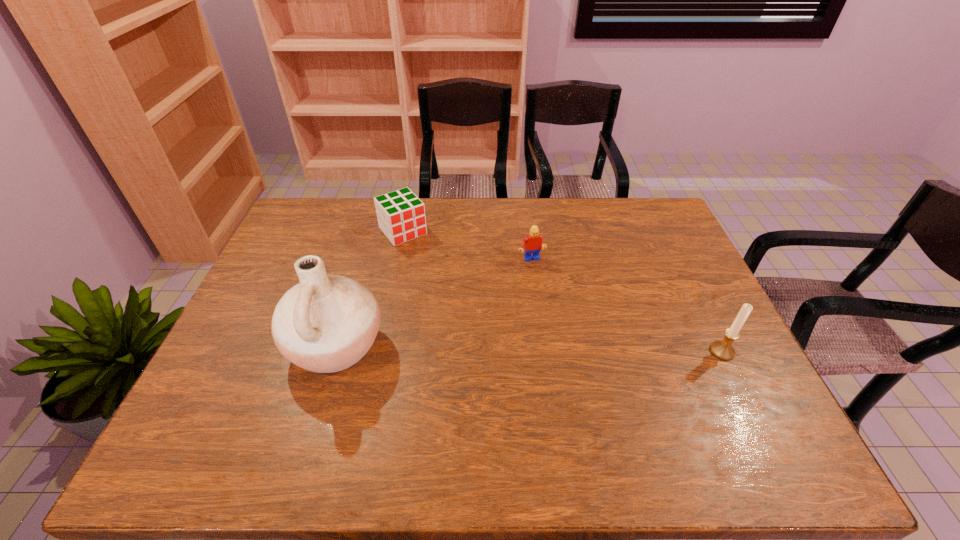
At what (x,y) coordinates should I click in order to perform the action: click on blank area located 0.370m on the front-facing side of the third object from left to right. Please return your answer as a coordinate pair (x, y). Image resolution: width=960 pixels, height=540 pixels. Looking at the image, I should click on (574, 357).

The width and height of the screenshot is (960, 540). In order to click on vacant space positioned 0.120m on the front-facing side of the third object from left to right in this screenshot , I will do `click(545, 290)`.

Image resolution: width=960 pixels, height=540 pixels. Identify the location of vacant space located on the red face of the cube. (448, 284).

Image resolution: width=960 pixels, height=540 pixels. I want to click on vacant space located on the red face of the cube, so click(x=434, y=268).

Locate an element on the screen. The height and width of the screenshot is (540, 960). free location located 0.210m on the red face of the cube is located at coordinates (445, 280).

I want to click on object that is at the far edge, so click(401, 216).

Find the location of a particular element. The height and width of the screenshot is (540, 960). object present at the near edge is located at coordinates (326, 323).

You are a GUI agent. You are given a task and a screenshot of the screen. Output one action in this format:
    pyautogui.click(x=<x>, y=<y>)
    Task: Click on the object that is at the left edge
    The image size is (960, 540).
    Given the screenshot: What is the action you would take?
    pyautogui.click(x=326, y=323)

This screenshot has height=540, width=960. I want to click on object that is positioned at the right edge, so click(723, 350).

This screenshot has height=540, width=960. In order to click on object positioned at the near left corner in this screenshot , I will do `click(326, 323)`.